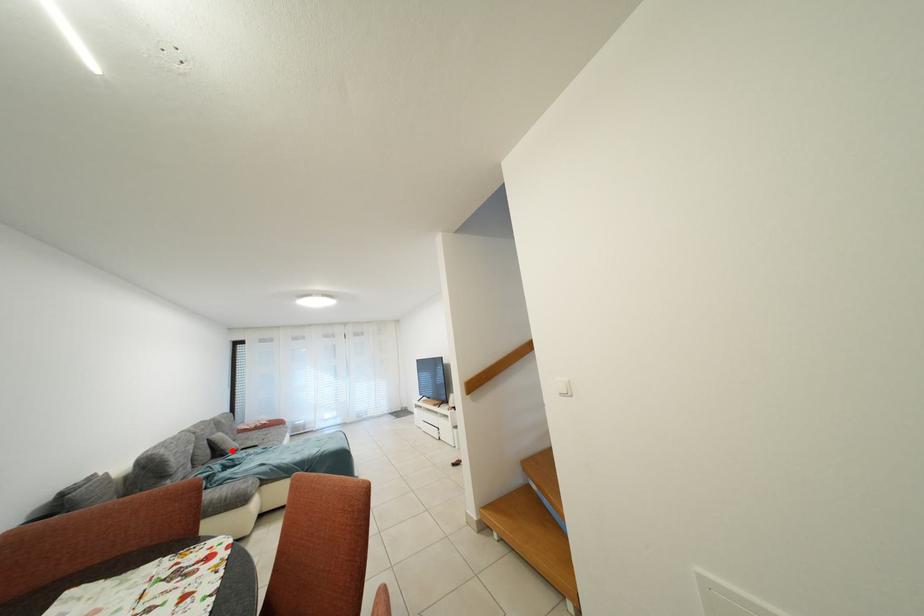
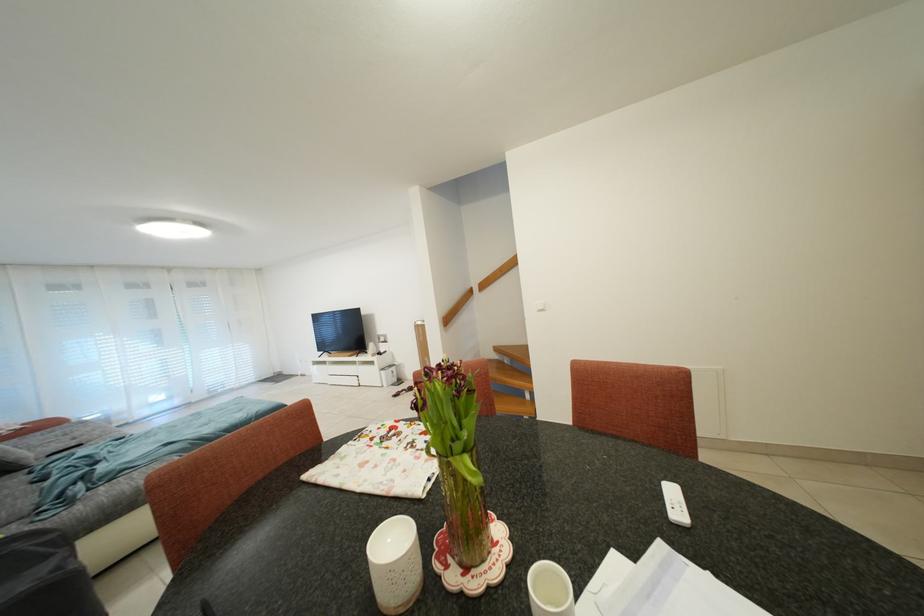
In the second image, find the point that corresponds to the highlighted location in the first image.

(19, 462)